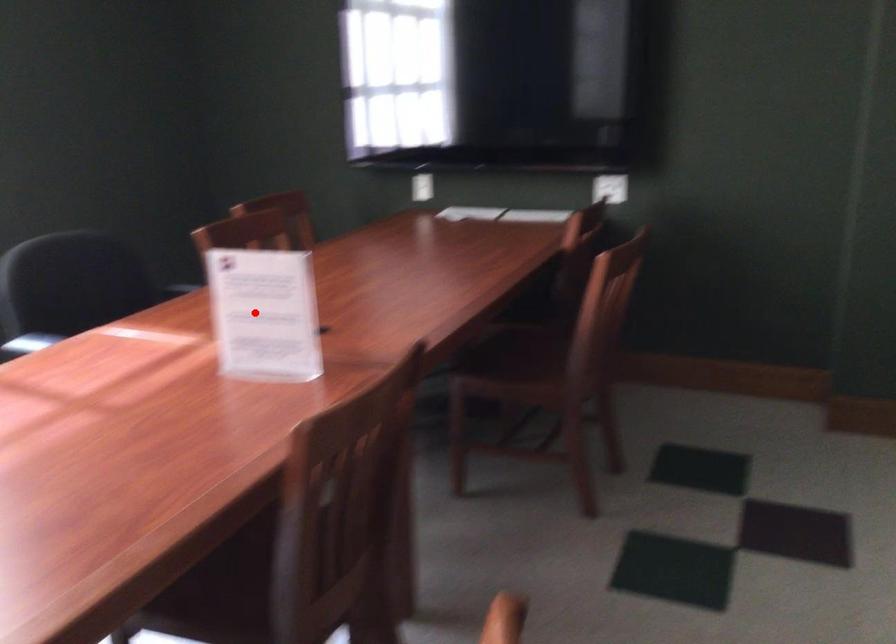
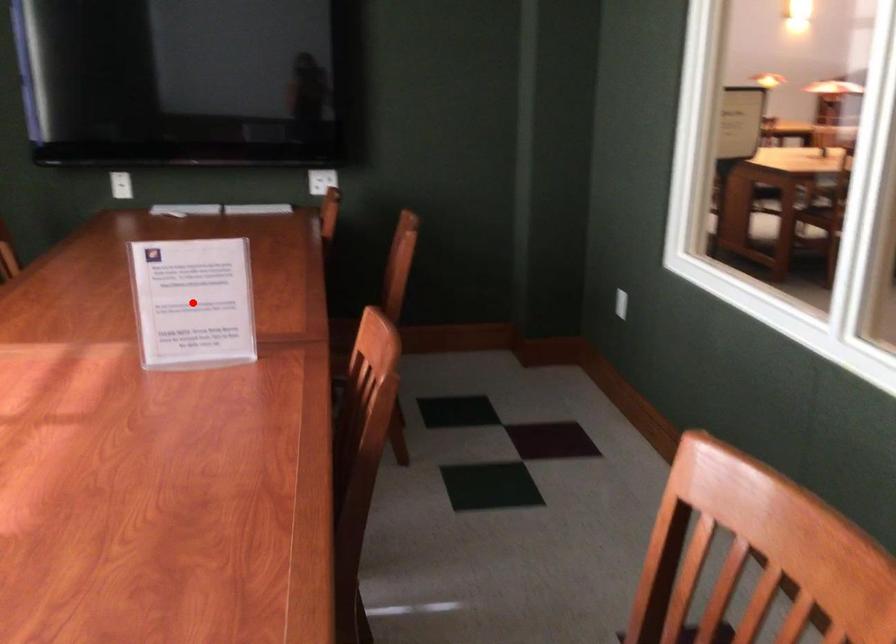
I am providing you with two images of the same scene from different viewpoints. A red point is marked on the first image and another point is marked on the second image. Does the point marked in image1 correspond to the same location as the one in image2?

Yes